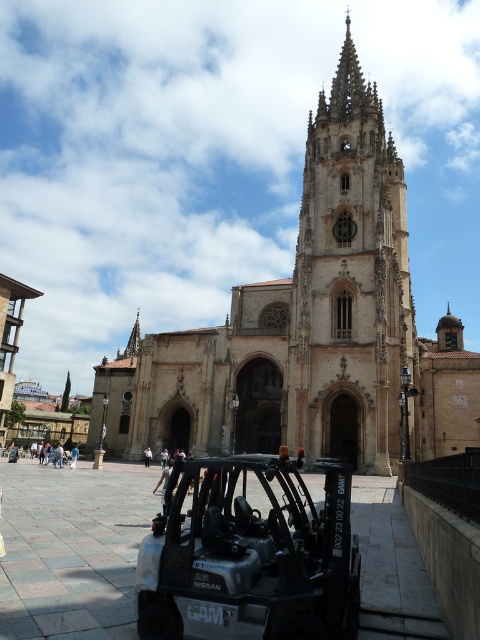
Does golden stone tower at center have a smaller size compared to black matte forklift at lower center?

No.

From the picture: Who is taller, golden stone tower at center or black matte forklift at lower center?

golden stone tower at center is taller.

Between point (383, 202) and point (348, 600), which one is positioned behind?

The point (383, 202) is more distant.

This screenshot has width=480, height=640. I want to click on golden stone tower at center, so click(x=349, y=282).

Does beige stone church at center appear under black matte forklift at lower center?

No.

Who is more distant from viewer, (x=321, y=340) or (x=222, y=566)?

Point (x=321, y=340)

Who is more forward, (325, 140) or (319, 624)?

Point (319, 624) is in front.

Where is `beige stone church at center`? beige stone church at center is located at coordinates (308, 328).

Is point (222, 365) positioned before point (309, 204)?

Yes.

Is beige stone church at center bigger than golden stone tower at center?

Indeed, beige stone church at center has a larger size compared to golden stone tower at center.

This screenshot has width=480, height=640. Describe the element at coordinates (308, 328) in the screenshot. I see `beige stone church at center` at that location.

Locate an element on the screen. This screenshot has width=480, height=640. beige stone church at center is located at coordinates click(x=308, y=328).